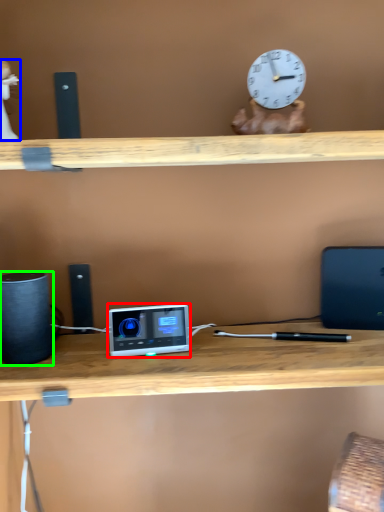
Question: Estimate the real-world distances between objects in this image. Which object is farther from ipod (highlighted by a red box), toy (highlighted by a blue box) or speaker (highlighted by a green box)?

Choices:
 (A) toy
 (B) speaker

Answer: (A)